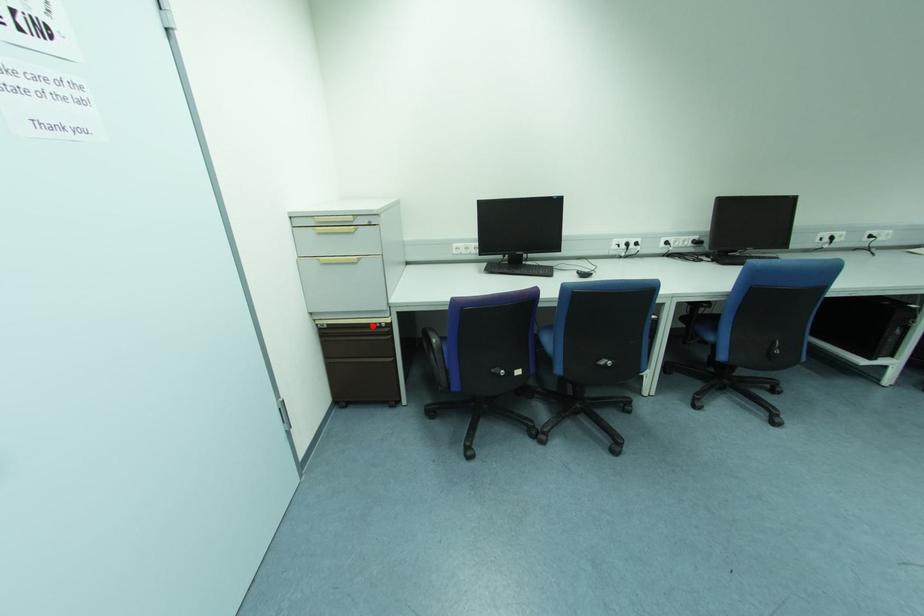
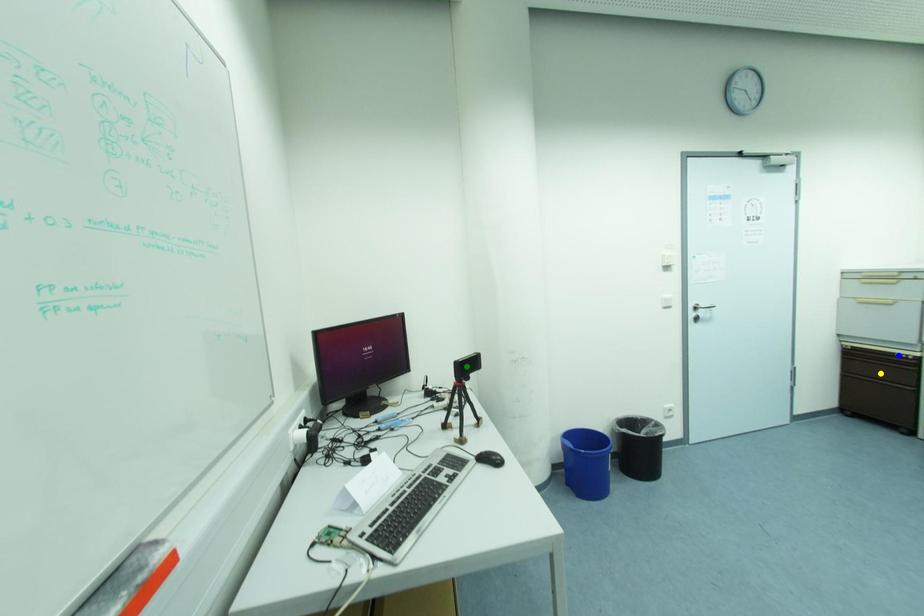
Question: I am providing you with two images of the same scene from different viewpoints. A red point is marked on the first image. You are given multiple points on the second image. In image 2, which mark is for the same physical point as the one in image 1?

Choices:
 (A) green point
 (B) yellow point
 (C) blue point

Answer: (C)